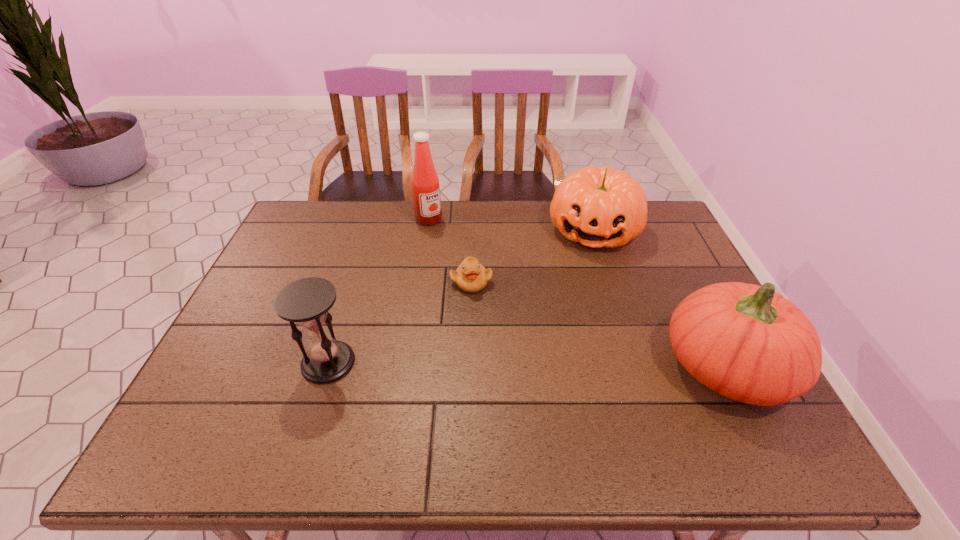
Identify the location of vacant space on the desktop that is between the leftmost object and the taller pumpkin and is positioned at the beak of the shortest object. (471, 364).

The image size is (960, 540). I want to click on vacant space on the desktop that is between the leftmost object and the nearer pumpkin and is positioned on the carved face of the shorter pumpkin, so click(566, 365).

This screenshot has height=540, width=960. Identify the location of vacant space on the desktop that is between the hourglass and the nearer pumpkin and is positioned on the front-facing side of the tallest object. (571, 365).